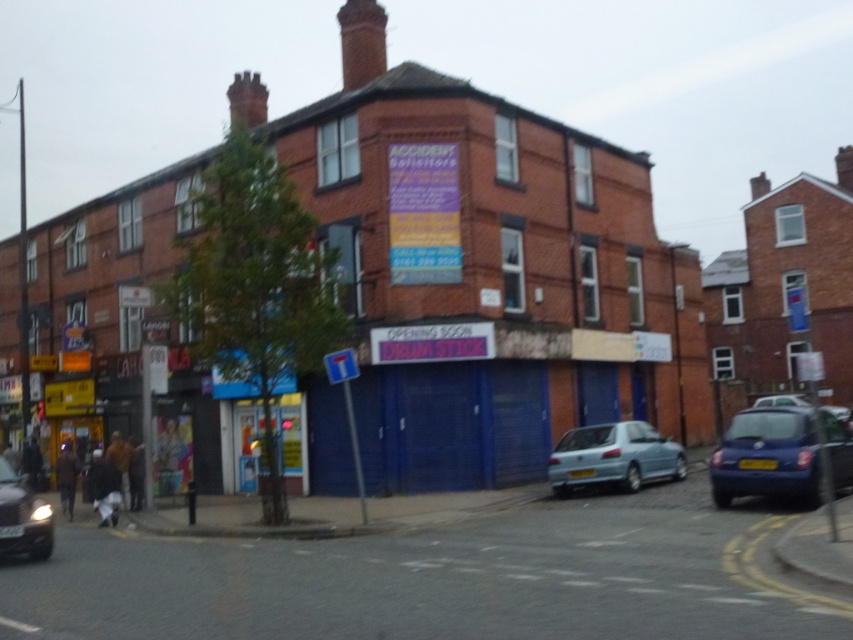
Does light blue metallic car at lower center have a smaller size compared to shiny silver car at lower left?

No.

Who is positioned more to the right, light blue metallic car at lower center or shiny silver car at lower left?

From the viewer's perspective, light blue metallic car at lower center appears more on the right side.

Does point (627, 451) come closer to viewer compared to point (15, 550)?

No, it is not.

In order to click on light blue metallic car at lower center in this screenshot , I will do `click(613, 456)`.

The height and width of the screenshot is (640, 853). What do you see at coordinates (767, 456) in the screenshot?
I see `metallic blue car at right` at bounding box center [767, 456].

This screenshot has width=853, height=640. Identify the location of metallic blue car at right. (767, 456).

Who is more distant from viewer, (838,458) or (6,529)?

The point (838,458) is behind.

Where is `metallic blue car at right`? metallic blue car at right is located at coordinates coord(767,456).

Can you confirm if metallic blue car at right is positioned to the left of light blue metallic car at lower center?

Incorrect, metallic blue car at right is not on the left side of light blue metallic car at lower center.

Does point (730, 448) come farther from viewer compared to point (624, 452)?

No, it is in front of (624, 452).

Describe the element at coordinates (767, 456) in the screenshot. I see `metallic blue car at right` at that location.

The image size is (853, 640). Find the location of `metallic blue car at right`. metallic blue car at right is located at coordinates (767, 456).